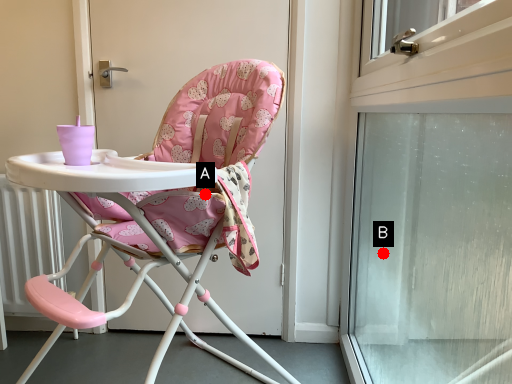
Question: Two points are circled on the image, labeled by A and B beside each circle. Which of the following is the farthest from the observer?

Choices:
 (A) A is further
 (B) B is further

Answer: (B)